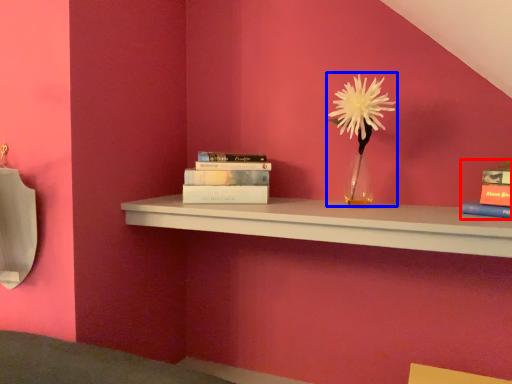
Question: Which object appears closest to the camera in this image, book (highlighted by a red box) or floral arrangement (highlighted by a blue box)?

Choices:
 (A) book
 (B) floral arrangement

Answer: (A)